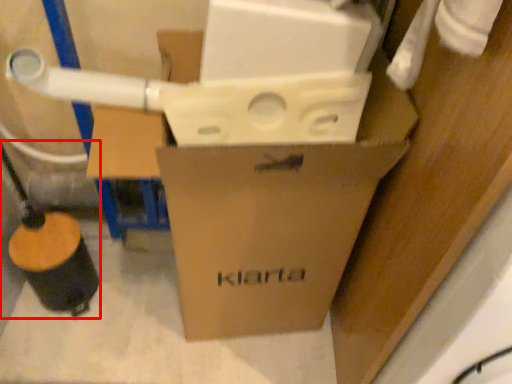
Question: Where is water pipe (annotated by the red box) located in relation to box in the image?

Choices:
 (A) right
 (B) left

Answer: (B)